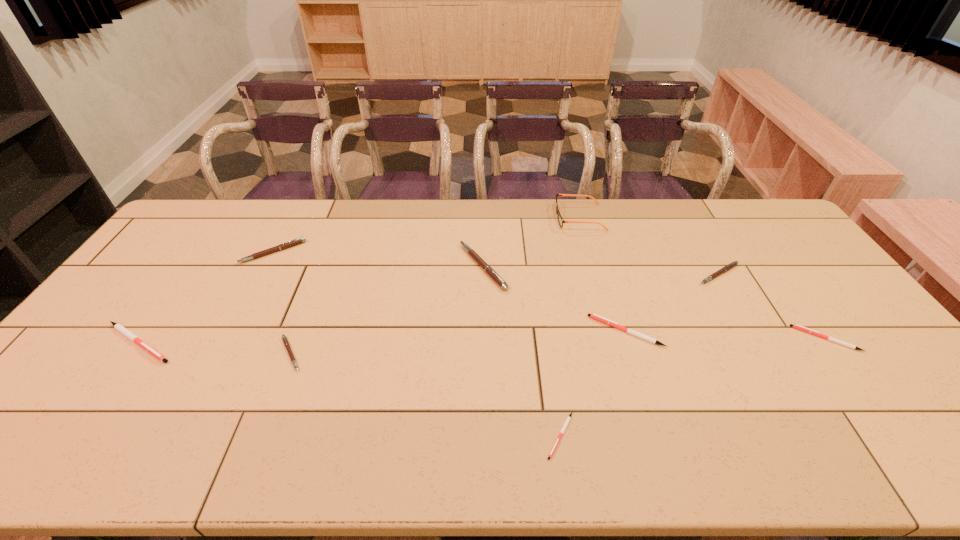
What are the coordinates of `free space located 0.170m on the front-facing side of the black spectacles` in the screenshot? It's located at (509, 217).

Where is `free space located at the nib of the fourth object from left to right`? free space located at the nib of the fourth object from left to right is located at coordinates (396, 267).

Where is `free region located at the nib of the fourth object from left to right`? This screenshot has height=540, width=960. free region located at the nib of the fourth object from left to right is located at coordinates (416, 267).

Locate an element on the screen. This screenshot has height=540, width=960. vacant space situated at the nib of the fourth object from left to right is located at coordinates (428, 267).

You are a GUI agent. You are given a task and a screenshot of the screen. Output one action in this format:
    pyautogui.click(x=<x>, y=<y>)
    Task: Click on the vacant region located at the nib of the second pen from left to right
    This screenshot has height=540, width=960.
    Given the screenshot: What is the action you would take?
    pyautogui.click(x=218, y=355)

You are a GUI agent. You are given a task and a screenshot of the screen. Output one action in this format:
    pyautogui.click(x=<x>, y=<y>)
    Task: Click on the vacant point located 0.290m on the clicker of the biggest white pen
    The height and width of the screenshot is (540, 960).
    Given the screenshot: What is the action you would take?
    pyautogui.click(x=289, y=342)

This screenshot has height=540, width=960. Find the location of `vacant space located 0.180m at the nib of the third biggest pink pen`. vacant space located 0.180m at the nib of the third biggest pink pen is located at coordinates (752, 330).

Locate an element on the screen. vacant space located on the clicker of the second white pen from right to left is located at coordinates (543, 331).

Image resolution: width=960 pixels, height=540 pixels. What are the coordinates of `free region located 0.310m on the clicker of the second white pen from right to left` in the screenshot? It's located at (479, 331).

This screenshot has width=960, height=540. Find the location of `free location located on the clicker of the second white pen from right to left`. free location located on the clicker of the second white pen from right to left is located at coordinates (551, 331).